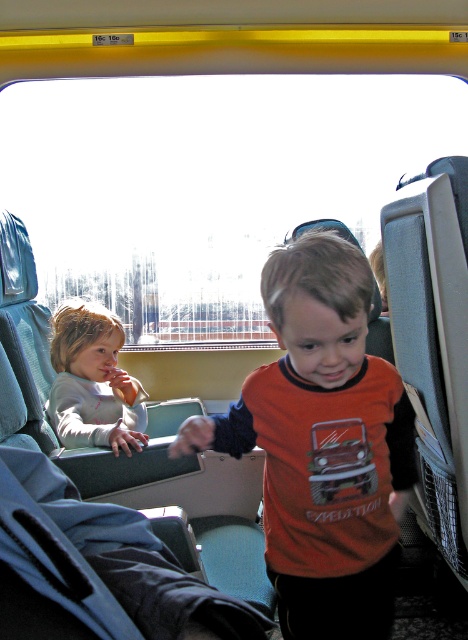
Can you confirm if blue fabric coach at lower left is smaller than light gray fleece shirt at left?

Yes.

Does blue fabric coach at lower left appear over light gray fleece shirt at left?

Actually, blue fabric coach at lower left is below light gray fleece shirt at left.

Who is more distant from viewer, (x=89, y=563) or (x=87, y=408)?

The point (x=87, y=408) is behind.

Locate an element on the screen. Image resolution: width=468 pixels, height=640 pixels. blue fabric coach at lower left is located at coordinates (96, 568).

Does orange matte shirt at center have a lesser height compared to blue fabric coach at lower left?

No, orange matte shirt at center is not shorter than blue fabric coach at lower left.

Is orange matte shirt at center above blue fabric coach at lower left?

Yes, orange matte shirt at center is above blue fabric coach at lower left.

Which is in front, point (306, 500) or point (50, 637)?

Point (50, 637) is more forward.

Where is `orange matte shirt at center`? This screenshot has height=640, width=468. orange matte shirt at center is located at coordinates (322, 444).

Can you confirm if orange matte shirt at center is positioned below light gray fleece shirt at left?

Correct, orange matte shirt at center is located below light gray fleece shirt at left.

Is orange matte shirt at center to the right of light gray fleece shirt at left from the viewer's perspective?

Correct, you'll find orange matte shirt at center to the right of light gray fleece shirt at left.

What do you see at coordinates (322, 444) in the screenshot? This screenshot has height=640, width=468. I see `orange matte shirt at center` at bounding box center [322, 444].

Find the location of `orange matte shirt at center`. orange matte shirt at center is located at coordinates (322, 444).